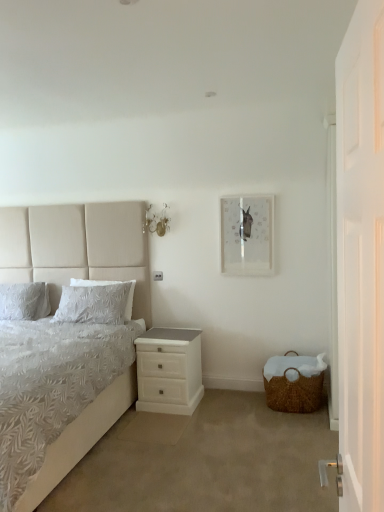
Question: Considering the positions of white wooden door at right and white textured pillow at left, which is counted as the second pillow, starting from the left, in the image, is white wooden door at right taller or shorter than white textured pillow at left, which is counted as the second pillow, starting from the left,?

Choices:
 (A) short
 (B) tall

Answer: (B)

Question: From the image's perspective, relative to white textured pillow at left, which is counted as the second pillow, starting from the left, is white wooden door at right above or below?

Choices:
 (A) below
 (B) above

Answer: (B)

Question: Which is nearer to the white wooden door at right?

Choices:
 (A) white textured bed at left
 (B) white textured pillow at left, which is counted as the 1th pillow, starting from the left
 (C) woven brown basket at lower right
 (D) white glossy nightstand at lower center
 (E) clear glass picture frame at upper center

Answer: (C)

Question: Which object is positioned farthest from the white wooden door at right?

Choices:
 (A) clear glass picture frame at upper center
 (B) white glossy nightstand at lower center
 (C) white textured bed at left
 (D) white textured pillow at left, the first pillow when ordered from right to left
 (E) white textured pillow at left, which is counted as the 1th pillow, starting from the left

Answer: (E)